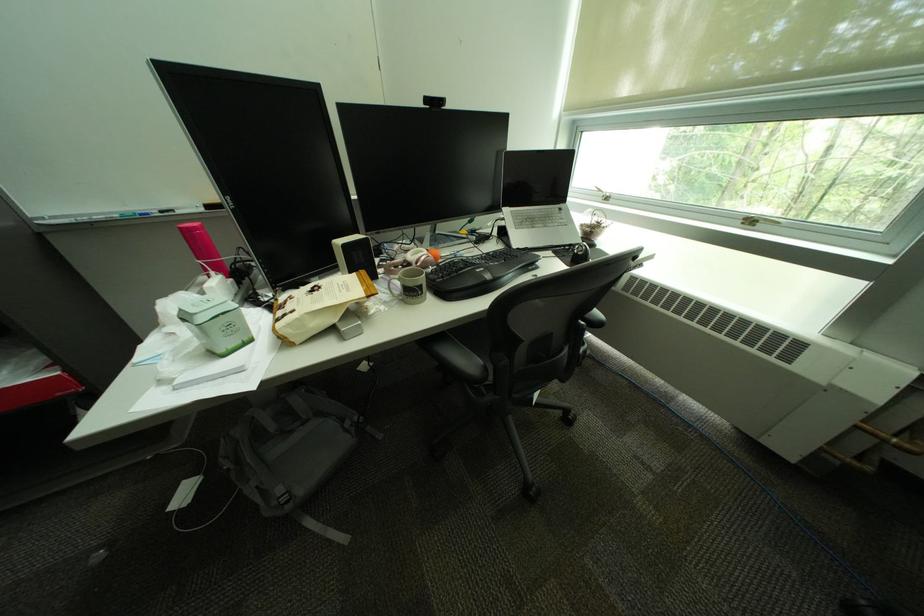
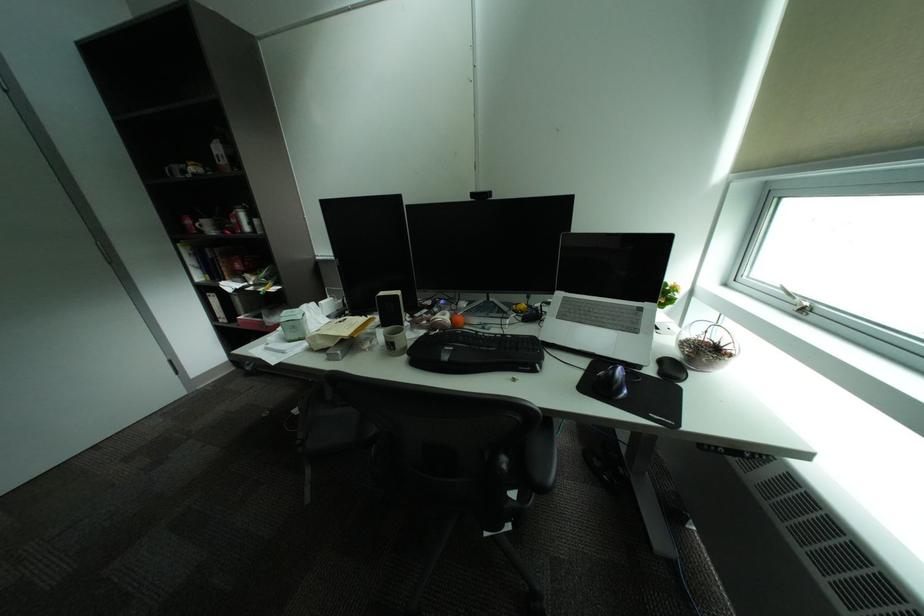
Find the pixel in the second image that matches (x=322, y=281) in the first image.

(385, 314)